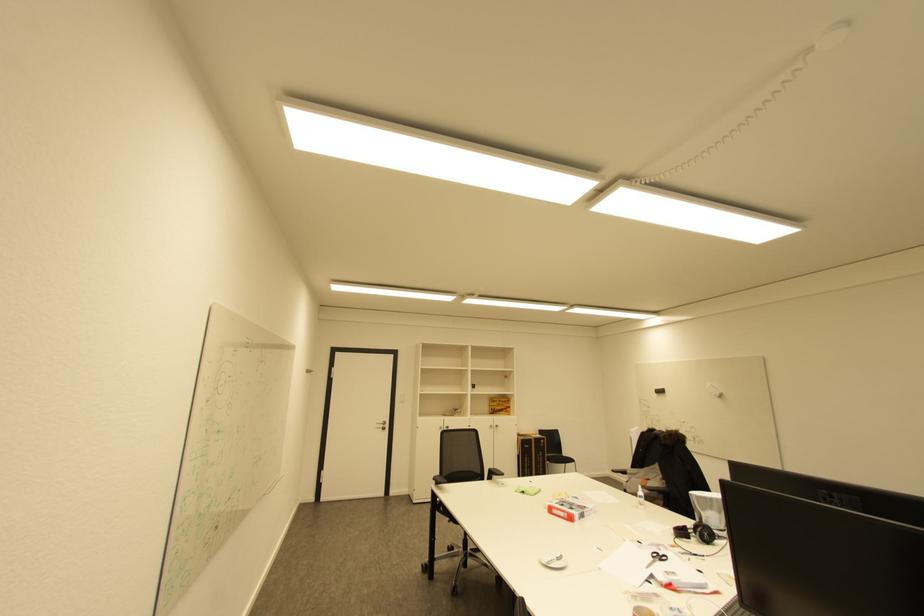
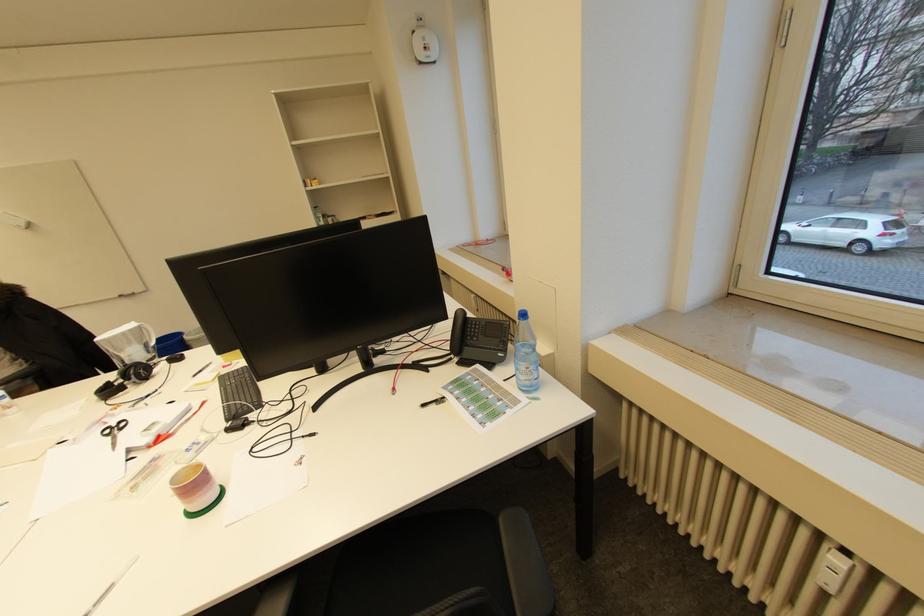
Where in the second image is the point corresponding to [704,533] from the first image?

(140, 377)